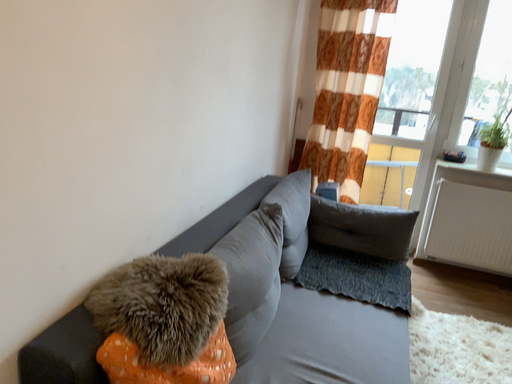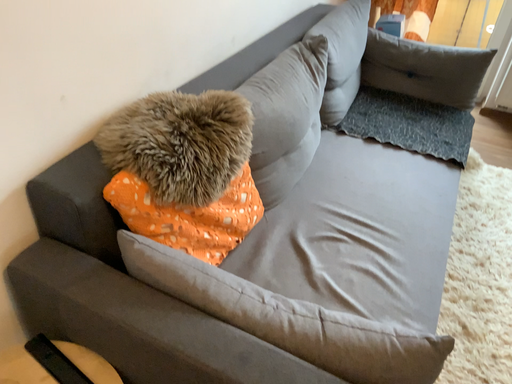
Question: How did the camera likely rotate when shooting the video?

Choices:
 (A) rotated right
 (B) rotated left

Answer: (B)